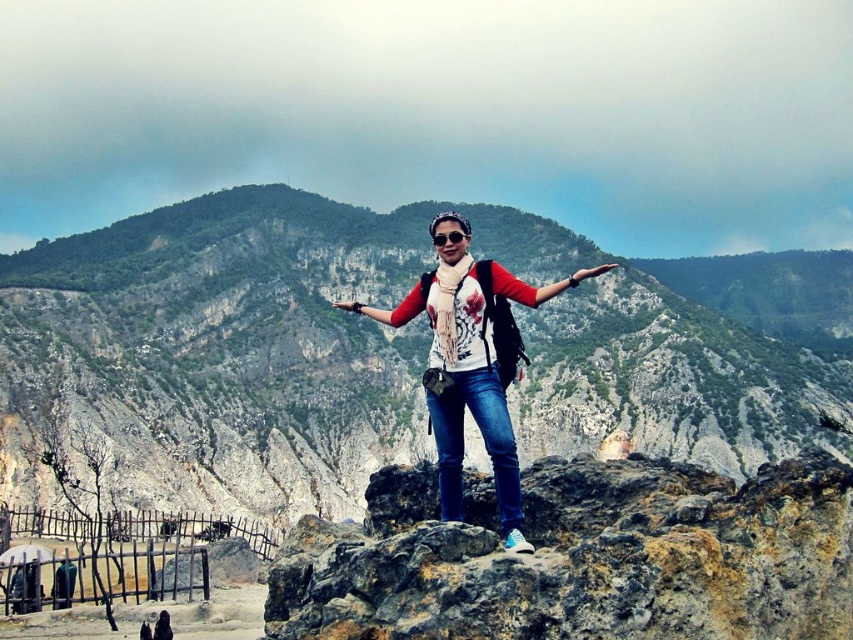
Question: Can you confirm if brown rocky outcrop at center is smaller than transparent plastic goggles at center?

Choices:
 (A) yes
 (B) no

Answer: (B)

Question: Among these objects, which one is farthest from the camera?

Choices:
 (A) transparent plastic goggles at center
 (B) rocky terrain at center

Answer: (B)

Question: Which object is closer to the camera taking this photo?

Choices:
 (A) white printed shirt at center
 (B) brown rocky outcrop at center
 (C) transparent plastic goggles at center
 (D) rocky terrain at center

Answer: (B)

Question: In this image, where is brown rocky outcrop at center located relative to transparent plastic goggles at center?

Choices:
 (A) right
 (B) left

Answer: (A)

Question: Estimate the real-world distances between objects in this image. Which object is farther from the rocky terrain at center?

Choices:
 (A) brown rocky outcrop at center
 (B) white printed shirt at center
 (C) transparent plastic goggles at center

Answer: (C)

Question: Is white printed shirt at center smaller than transparent plastic goggles at center?

Choices:
 (A) yes
 (B) no

Answer: (B)